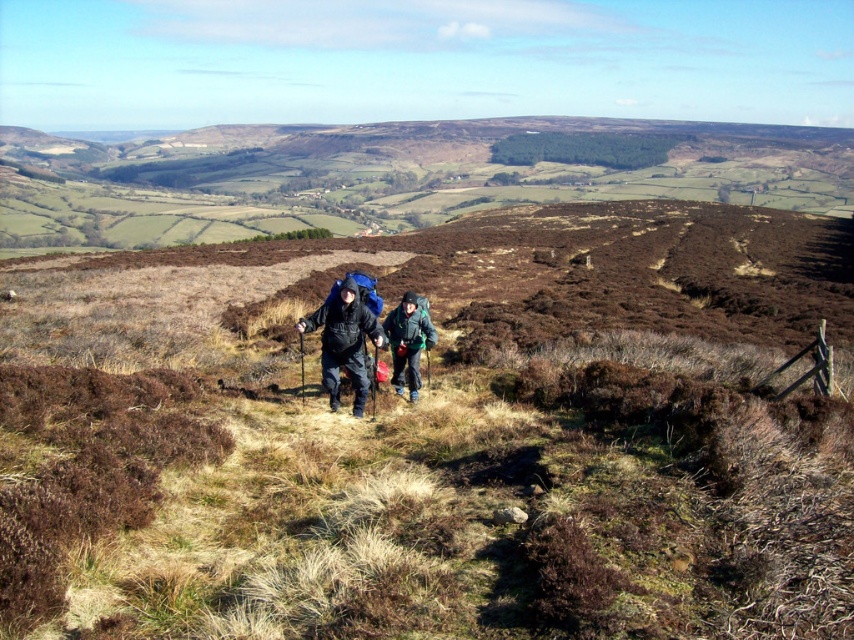
Does brown dry grass at center appear on the left side of dark green fabric jacket at center?

Indeed, brown dry grass at center is positioned on the left side of dark green fabric jacket at center.

Does brown dry grass at center appear over dark green fabric jacket at center?

Yes.

Is point (594, 259) positioned behind point (395, 307)?

Yes, point (594, 259) is farther from viewer.

Find the location of a particular element. This screenshot has width=854, height=640. brown dry grass at center is located at coordinates (436, 435).

Which of these two, brown dry grass at center or matte black backpack at center, stands shorter?

matte black backpack at center is shorter.

Does brown dry grass at center come behind matte black backpack at center?

No, it is in front of matte black backpack at center.

Measure the distance between point (537, 253) and camera.

Point (537, 253) and camera are 72.14 meters apart.

At what (x,y) coordinates should I click in order to perform the action: click on brown dry grass at center. Please return your answer as a coordinate pair (x, y). The image size is (854, 640). Looking at the image, I should click on (436, 435).

Is matte black backpack at center below dark green fabric jacket at center?

Indeed, matte black backpack at center is positioned under dark green fabric jacket at center.

Does matte black backpack at center have a greater height compared to dark green fabric jacket at center?

Yes.

Is point (364, 314) farther from camera compared to point (395, 392)?

No.

Locate an element on the screen. matte black backpack at center is located at coordinates (344, 340).